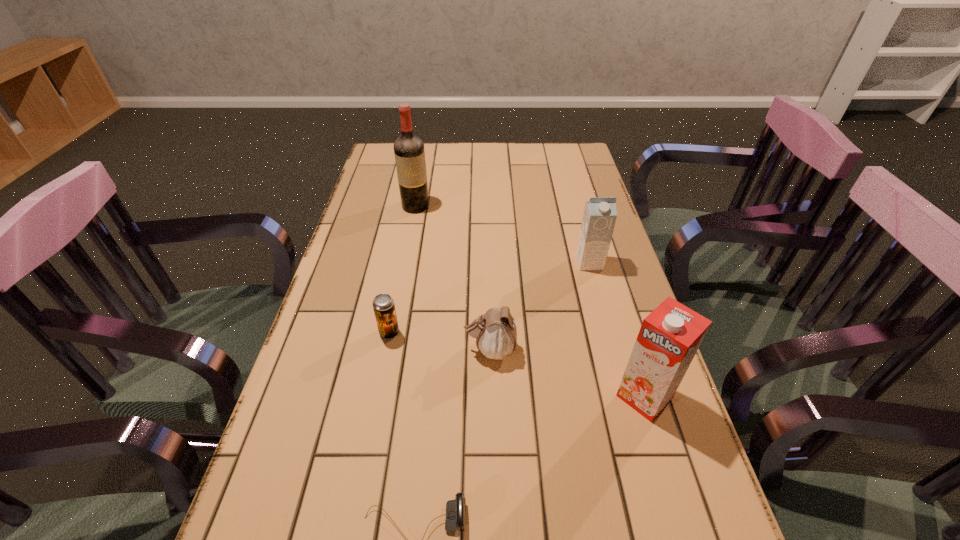
Where is `free location that satisfies the following two spatial constraints: 1. on the front-facing side of the pouch; 2. on the right side of the taller carton`? The width and height of the screenshot is (960, 540). free location that satisfies the following two spatial constraints: 1. on the front-facing side of the pouch; 2. on the right side of the taller carton is located at coordinates (491, 396).